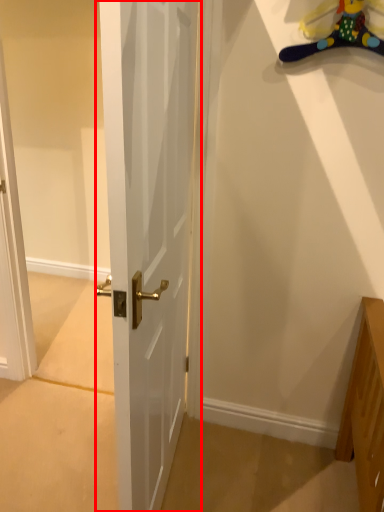
Question: From the image's perspective, where is door (annotated by the red box) located in relation to toy in the image?

Choices:
 (A) below
 (B) above

Answer: (A)